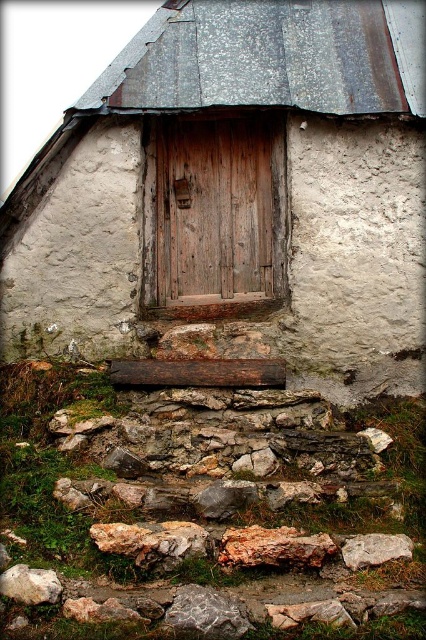
Who is more forward, (230, 596) or (20, 584)?

Point (20, 584)

Which is more to the left, rocky gray stone at lower center or speckled gray rock at lower left?

speckled gray rock at lower left is more to the left.

Is point (229, 628) positioned in front of point (20, 564)?

Yes, it is.

The image size is (426, 640). Identify the location of rocky gray stone at lower center. (206, 612).

This screenshot has width=426, height=640. Describe the element at coordinates (206, 612) in the screenshot. I see `rocky gray stone at lower center` at that location.

Which of these two, rocky gray stone at lower center or gray rough rock at lower right, stands shorter?

rocky gray stone at lower center

Between point (210, 609) and point (359, 568), which one is positioned in front?

Point (210, 609) is more forward.

At what (x,y) coordinates should I click in order to perform the action: click on rocky gray stone at lower center. Please return your answer as a coordinate pair (x, y). Looking at the image, I should click on (206, 612).

Does wooden door at center have a greater height compared to gray rough stone at lower center?

Indeed, wooden door at center has a greater height compared to gray rough stone at lower center.

Can you confirm if wooden door at center is shorter than gray rough stone at lower center?

No.

Is point (256, 147) positioned before point (238, 508)?

No, (256, 147) is behind (238, 508).

Image resolution: width=426 pixels, height=640 pixels. I want to click on wooden door at center, so click(236, 195).